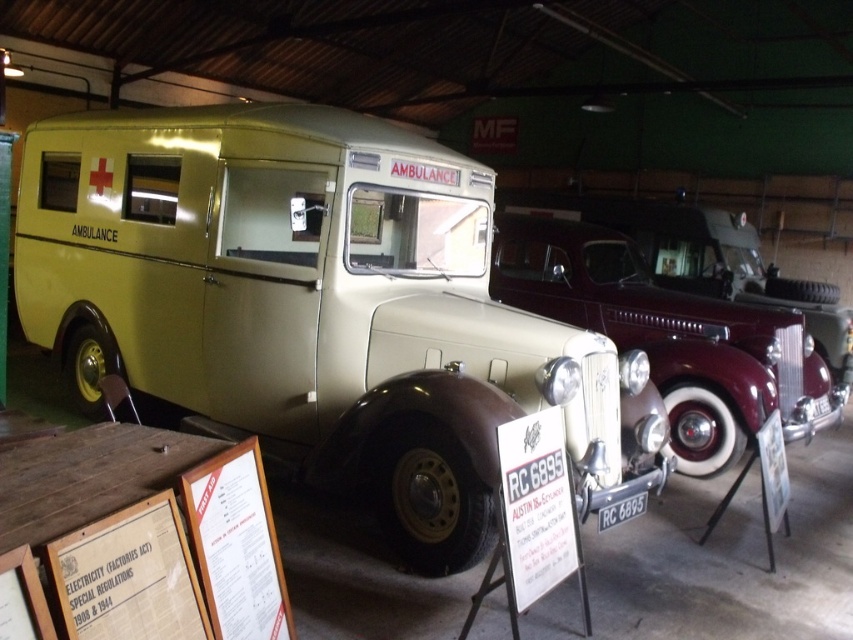
Find the location of `matte beige ambulance at center`. matte beige ambulance at center is located at coordinates [314, 305].

Does point (459, 376) come in front of point (608, 243)?

Yes.

This screenshot has width=853, height=640. In order to click on matte beige ambulance at center in this screenshot , I will do 314,305.